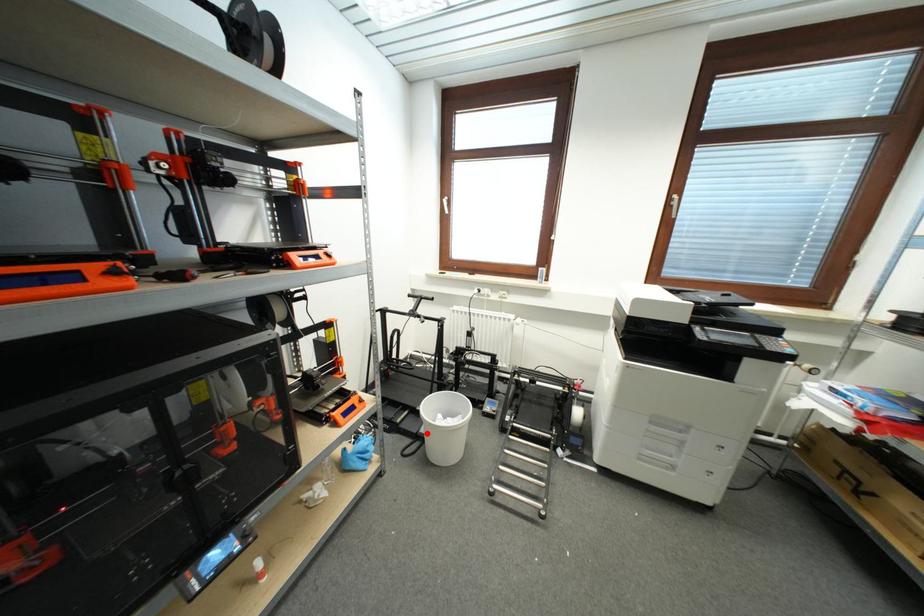
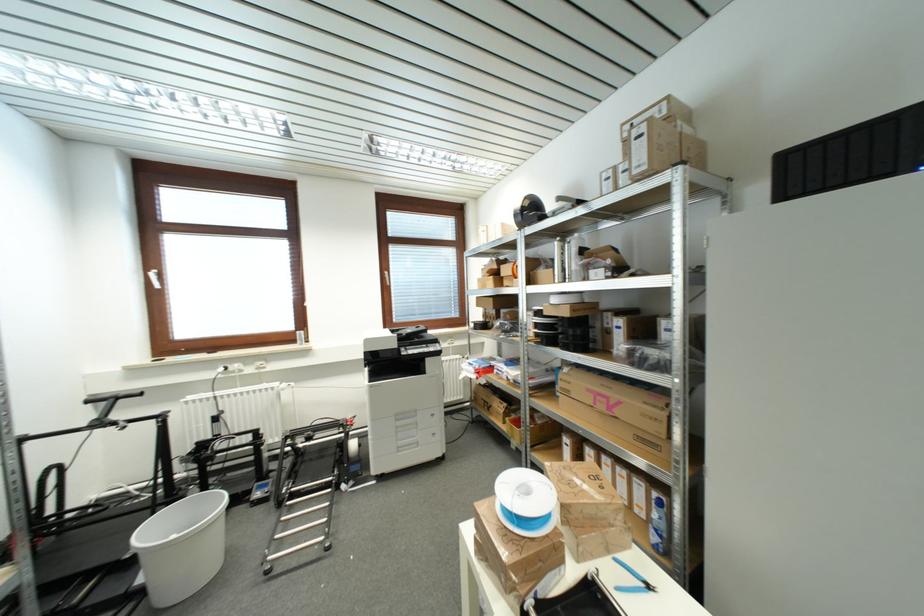
Locate, in the second image, the point that corresponds to the highlighted location in the first image.

(144, 582)